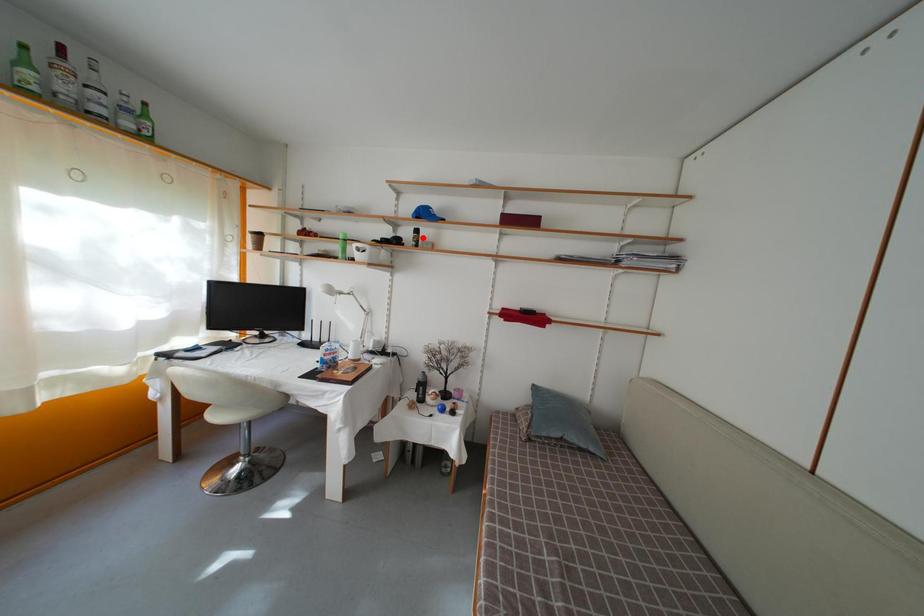
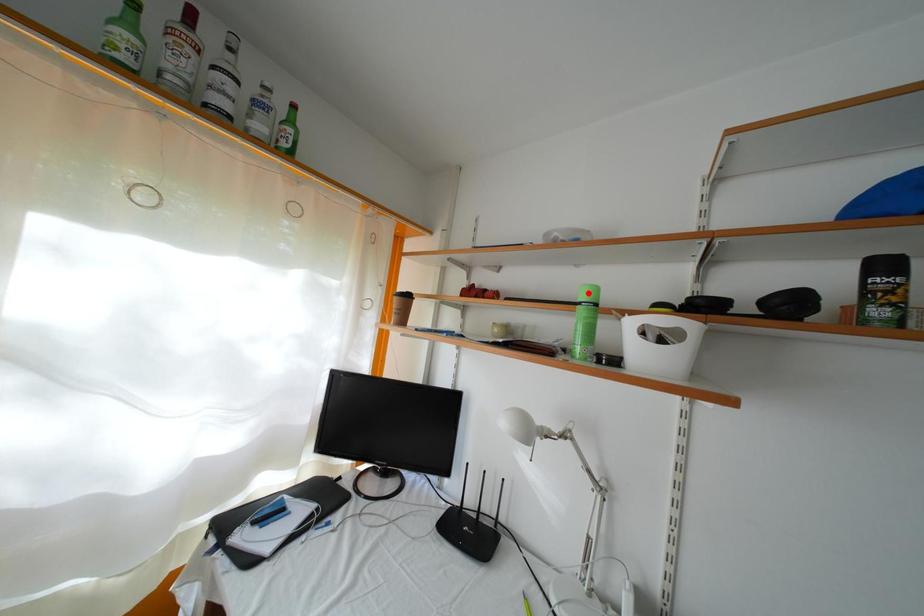
I am providing you with two images of the same scene from different viewpoints. A red point is marked on the first image and another point is marked on the second image. Do the highlighted points in image1 and image2 indicate the same real-world spot?

No